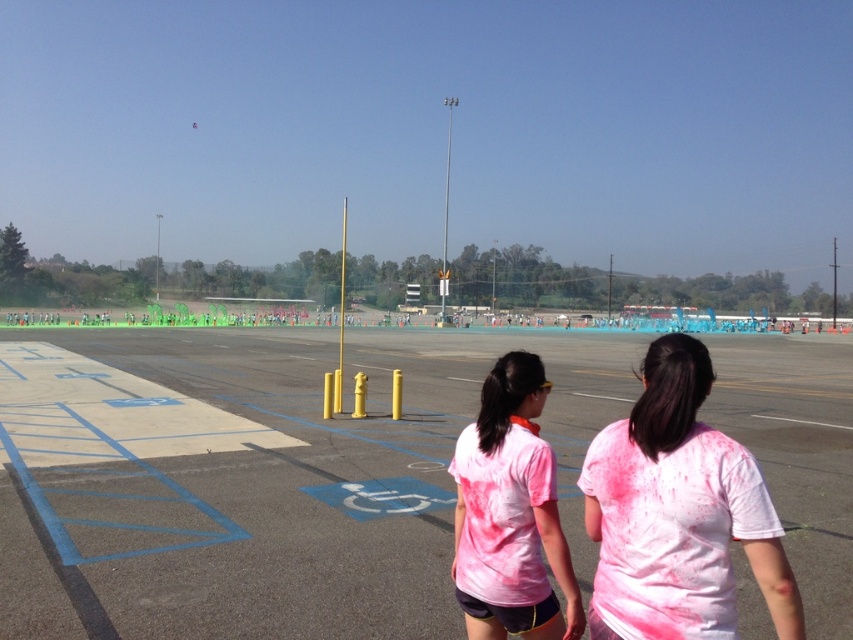
Who is more distant from viewer, (476, 401) or (646, 394)?

A: The point (476, 401) is more distant.

Between white asphalt tarmac at center and white cotton t-shirt at center, which one appears on the left side from the viewer's perspective?

white asphalt tarmac at center

The image size is (853, 640). Identify the location of white asphalt tarmac at center. [287, 488].

This screenshot has width=853, height=640. What do you see at coordinates (287, 488) in the screenshot? I see `white asphalt tarmac at center` at bounding box center [287, 488].

Is white asphalt tarmac at center bigger than pink tie-dye t-shirt at center?

Indeed, white asphalt tarmac at center has a larger size compared to pink tie-dye t-shirt at center.

Is point (155, 605) less distant than point (552, 595)?

No.

The image size is (853, 640). In order to click on white asphalt tarmac at center in this screenshot , I will do `click(287, 488)`.

At what (x,y) coordinates should I click in order to perform the action: click on white cotton t-shirt at center. Please return your answer as a coordinate pair (x, y). Looking at the image, I should click on (677, 513).

Which of these two, white cotton t-shirt at center or pink tie-dye t-shirt at center, stands shorter?

pink tie-dye t-shirt at center

Between point (679, 362) and point (550, 548), which one is positioned in front?

Point (679, 362)

Locate an element on the screen. The image size is (853, 640). white cotton t-shirt at center is located at coordinates (677, 513).